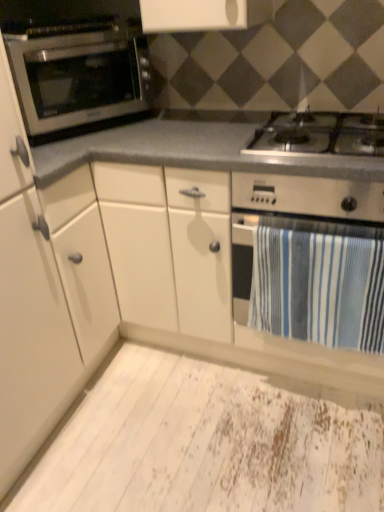
Question: Is white matte cabinet at left thinner than white distressed plywood at lower center?

Choices:
 (A) yes
 (B) no

Answer: (A)

Question: Is white matte cabinet at left smaller than white distressed plywood at lower center?

Choices:
 (A) no
 (B) yes

Answer: (A)

Question: Is white matte cabinet at left not inside white distressed plywood at lower center?

Choices:
 (A) no
 (B) yes

Answer: (B)

Question: Is white distressed plywood at lower center located within white matte cabinet at left?

Choices:
 (A) yes
 (B) no

Answer: (B)

Question: Is white matte cabinet at left not close to white distressed plywood at lower center?

Choices:
 (A) yes
 (B) no

Answer: (B)

Question: Looking at the image, does satin silver oven at left seem bigger or smaller compared to white matte cabinet at left?

Choices:
 (A) big
 (B) small

Answer: (B)

Question: In terms of width, does satin silver oven at left look wider or thinner when compared to white matte cabinet at left?

Choices:
 (A) thin
 (B) wide

Answer: (A)

Question: Is satin silver oven at left in front of or behind white matte cabinet at left in the image?

Choices:
 (A) behind
 (B) front

Answer: (A)

Question: From a real-world perspective, is satin silver oven at left positioned above or below white matte cabinet at left?

Choices:
 (A) above
 (B) below

Answer: (A)

Question: Do you think white matte cabinet at left is within stainless steel gas stove at center, or outside of it?

Choices:
 (A) inside
 (B) outside

Answer: (B)

Question: From their relative heights in the image, would you say white matte cabinet at left is taller or shorter than stainless steel gas stove at center?

Choices:
 (A) short
 (B) tall

Answer: (B)

Question: From a real-world perspective, is white matte cabinet at left physically located above or below stainless steel gas stove at center?

Choices:
 (A) below
 (B) above

Answer: (A)

Question: Considering the positions of white matte cabinet at left and stainless steel gas stove at center in the image, is white matte cabinet at left bigger or smaller than stainless steel gas stove at center?

Choices:
 (A) big
 (B) small

Answer: (A)

Question: Considering the positions of white matte cabinet at left and white distressed plywood at lower center in the image, is white matte cabinet at left taller or shorter than white distressed plywood at lower center?

Choices:
 (A) short
 (B) tall

Answer: (B)

Question: Is point (21, 366) positioned closer to the camera than point (109, 394)?

Choices:
 (A) closer
 (B) farther

Answer: (A)